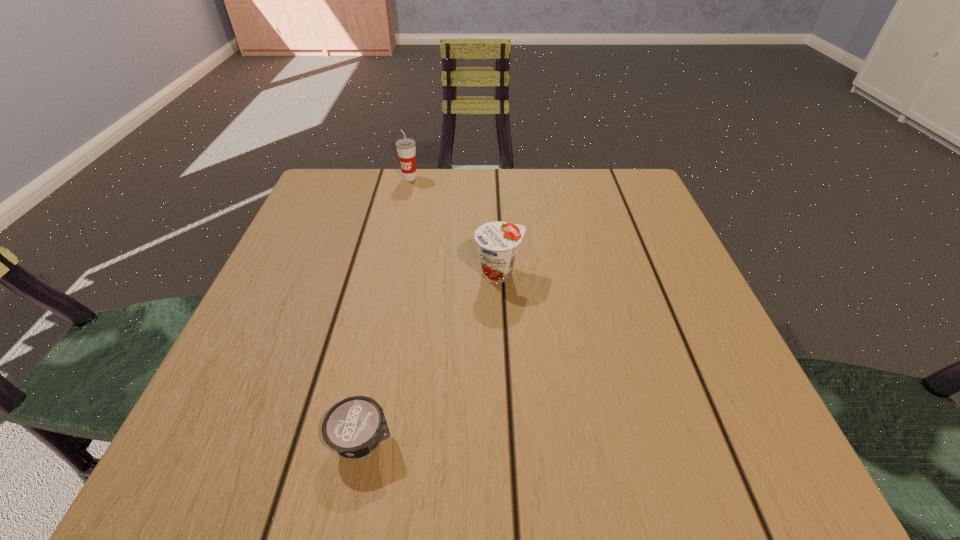
Find the location of a particular element. The height and width of the screenshot is (540, 960). object at the near edge is located at coordinates (353, 427).

At what (x,y) coordinates should I click in order to perform the action: click on free space at the far edge of the desktop. Please return your answer as a coordinate pair (x, y). Looking at the image, I should click on (517, 212).

This screenshot has height=540, width=960. I want to click on vacant space at the near edge, so click(x=516, y=449).

Where is `vacant space at the left edge of the desktop`? Image resolution: width=960 pixels, height=540 pixels. vacant space at the left edge of the desktop is located at coordinates (321, 262).

I want to click on free region at the right edge, so tap(664, 306).

In the image, there is a desktop. Identify the location of vacant region at the far left corner. (378, 186).

The width and height of the screenshot is (960, 540). In the image, there is a desktop. What are the coordinates of `vacant space at the near left corner` in the screenshot? It's located at (259, 446).

What are the coordinates of `vacant area at the far right corner` in the screenshot? It's located at (609, 195).

Find the location of a particular element. The image size is (960, 540). unoccupied position between the tallest object and the shorter yogurt is located at coordinates (387, 309).

Identify the location of vacant area that lies between the nearer yogurt and the farther yogurt. This screenshot has width=960, height=540. (431, 356).